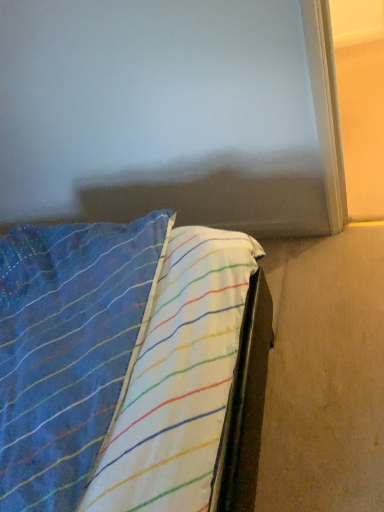
In order to face striped fabric bed at lower left, should I rotate leftwards or rightwards?

Rotate your view left by about 16.720°.

I want to click on striped fabric bed at lower left, so click(125, 364).

What do you see at coordinates (125, 364) in the screenshot? I see `striped fabric bed at lower left` at bounding box center [125, 364].

The image size is (384, 512). I want to click on striped fabric bed at lower left, so click(x=125, y=364).